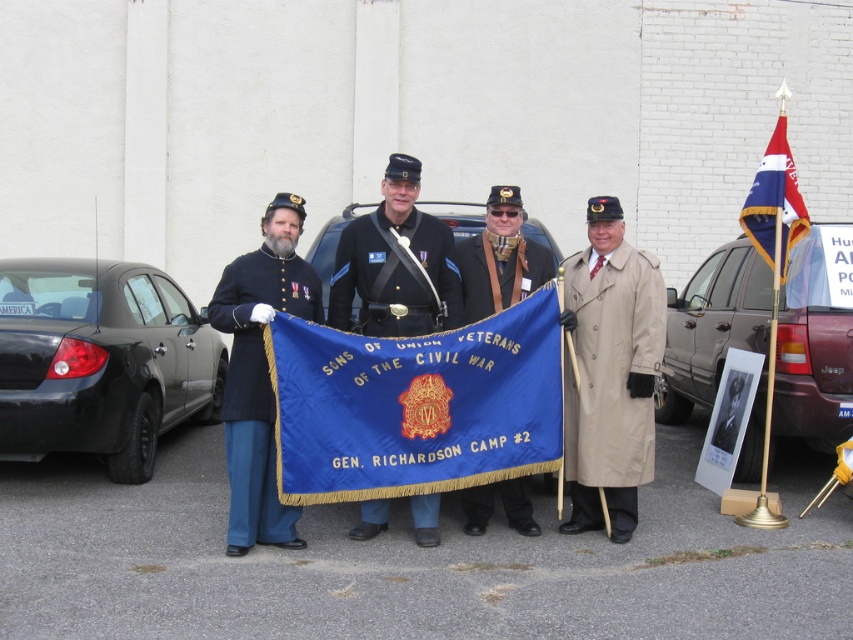
Can you confirm if blue fabric flag at center is positioned to the left of maroon metallic suv at right?

Indeed, blue fabric flag at center is positioned on the left side of maroon metallic suv at right.

Who is more forward, (347, 394) or (740, 316)?

Point (347, 394)

The width and height of the screenshot is (853, 640). Identify the location of blue fabric flag at center. (415, 404).

Between point (798, 328) and point (509, 512), which one is positioned behind?

Positioned behind is point (798, 328).

Does maroon metallic suv at right have a lesser height compared to blue velvet flag at center?

No.

This screenshot has height=640, width=853. What do you see at coordinates (711, 326) in the screenshot?
I see `maroon metallic suv at right` at bounding box center [711, 326].

I want to click on maroon metallic suv at right, so click(x=711, y=326).

Which is behind, point (396, 260) or point (152, 417)?

The point (152, 417) is more distant.

Does point (612, 419) lie behind point (13, 362)?

No, it is in front of (13, 362).

At what (x,y) coordinates should I click in order to perform the action: click on blue cotton flag at center. Please return your answer as a coordinate pair (x, y). The height and width of the screenshot is (640, 853). Looking at the image, I should click on (619, 394).